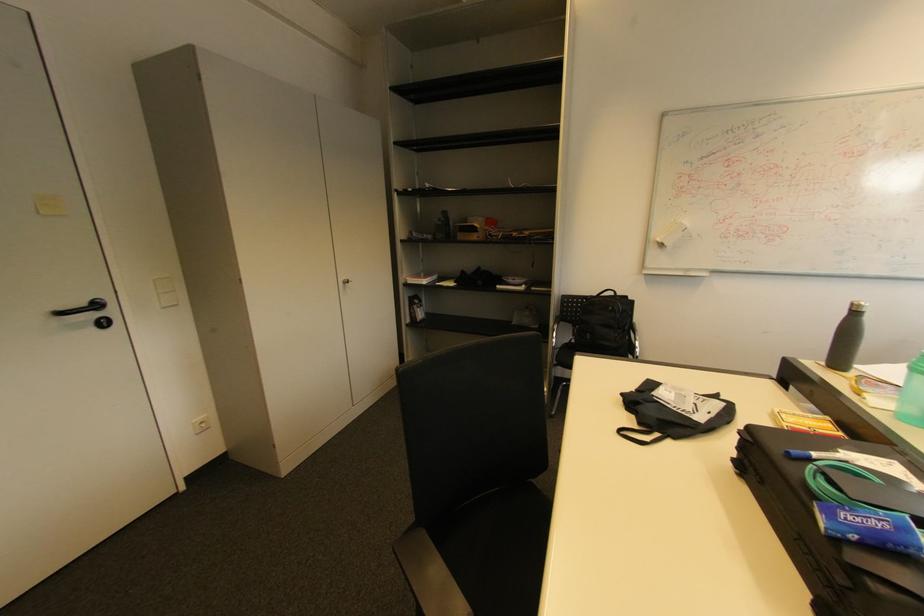
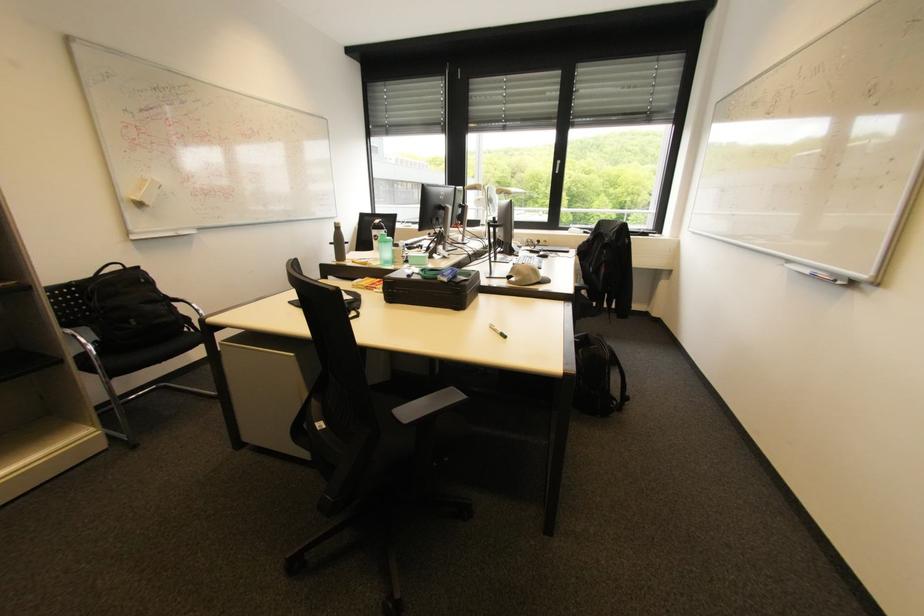
In the second image, find the point that corresponds to pixel 615 309 in the first image.

(148, 281)